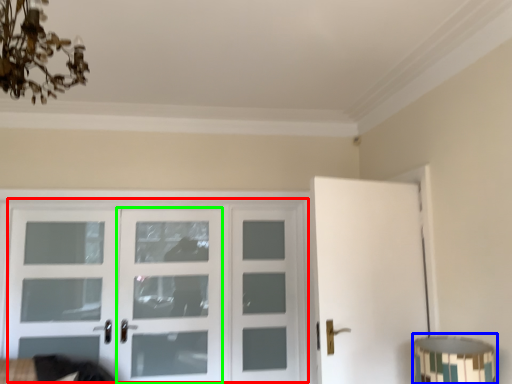
Question: Which is nearer to the door (highlighted by a red box)? table lamp (highlighted by a blue box) or screen door (highlighted by a green box).

Choices:
 (A) table lamp
 (B) screen door

Answer: (B)